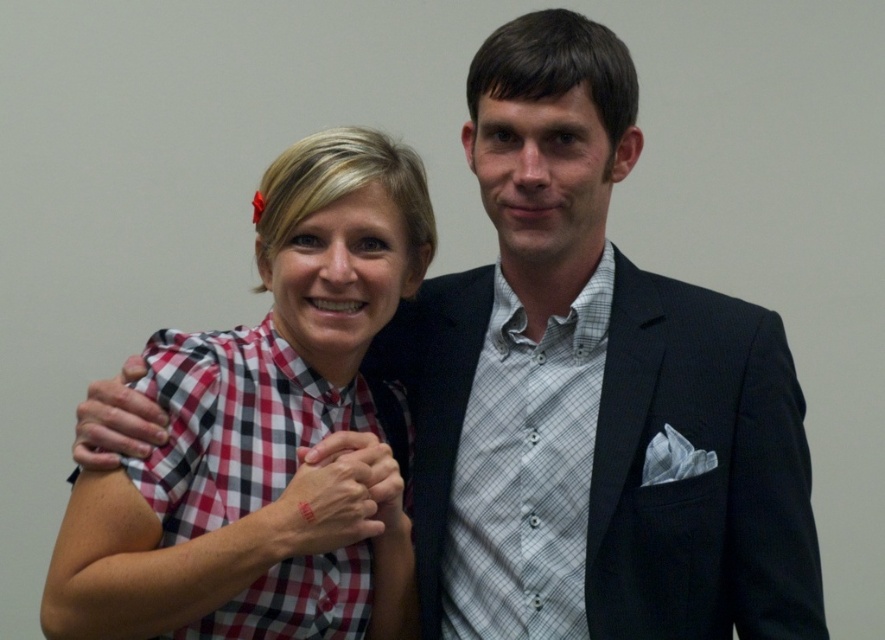
Question: Which object is farther from the camera taking this photo?

Choices:
 (A) matte red plaid shirt at upper left
 (B) gray checkered shirt at center
 (C) checkered fabric shirt at center

Answer: (B)

Question: Among these points, which one is nearest to the camera?

Choices:
 (A) (385, 550)
 (B) (525, 429)
 (C) (324, 312)
 (D) (147, 436)

Answer: (D)

Question: Among these objects, which one is farthest from the camera?

Choices:
 (A) gray checkered shirt at center
 (B) matte red checkered shirt at center
 (C) checkered fabric shirt at center

Answer: (A)

Question: Does checkered fabric shirt at center have a lesser width compared to matte red plaid shirt at upper left?

Choices:
 (A) no
 (B) yes

Answer: (A)

Question: Does matte red checkered shirt at center appear over matte red plaid shirt at upper left?

Choices:
 (A) yes
 (B) no

Answer: (B)

Question: Is gray checkered shirt at center further to the viewer compared to matte red plaid shirt at upper left?

Choices:
 (A) yes
 (B) no

Answer: (A)